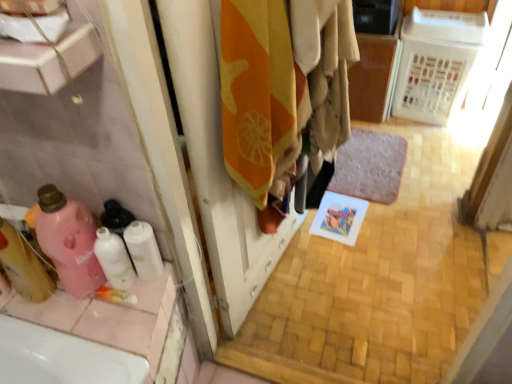
Question: Relative to translucent pink bottle at left, marked as the first cleaning product in a left-to-right arrangement, is orange cotton towel at center in front or behind?

Choices:
 (A) behind
 (B) front

Answer: (B)

Question: Looking at the image, does orange cotton towel at center seem bigger or smaller compared to translucent pink bottle at left, which ranks as the third cleaning product in right-to-left order?

Choices:
 (A) big
 (B) small

Answer: (A)

Question: Which is nearer to the white plastic laundry basket at upper right?

Choices:
 (A) gray plush bath mat at center
 (B) orange cotton towel at center
 (C) white matte toilet paper at lower left
 (D) pink matte bottle at lower left, acting as the 2th cleaning product starting from the left
 (E) white glossy bottles at lower left, which ranks as the 3th cleaning product in left-to-right order

Answer: (A)

Question: Based on their relative distances, which object is farther from the white matte toilet paper at lower left?

Choices:
 (A) translucent pink bottle at left, marked as the first cleaning product in a left-to-right arrangement
 (B) gray plush bath mat at center
 (C) white plastic laundry basket at upper right
 (D) orange cotton towel at center
 (E) white glossy bottles at lower left, which is the first cleaning product in right-to-left order

Answer: (C)